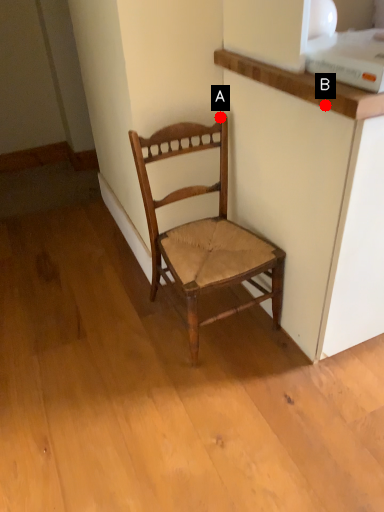
Question: Two points are circled on the image, labeled by A and B beside each circle. Which point appears closest to the camera in this image?

Choices:
 (A) A is closer
 (B) B is closer

Answer: (B)